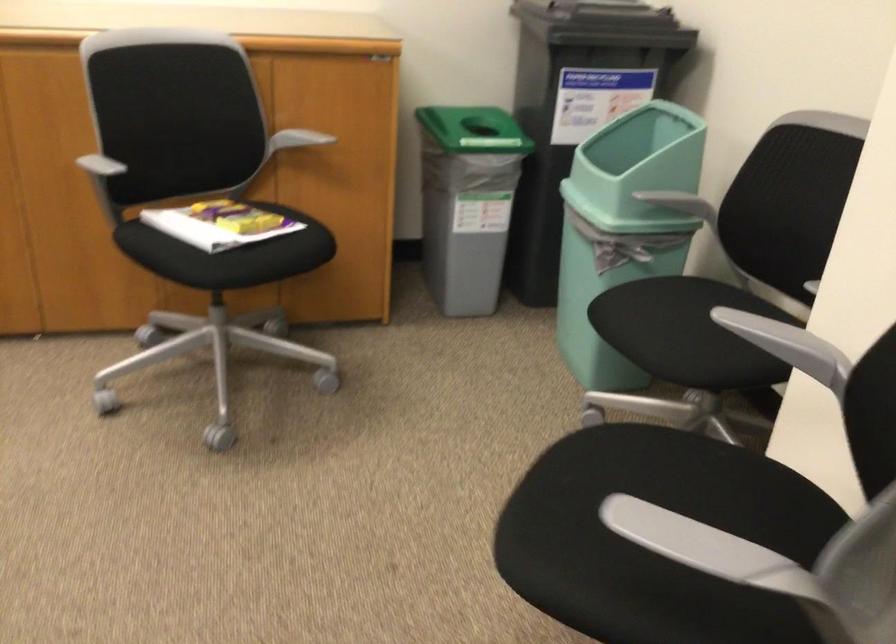
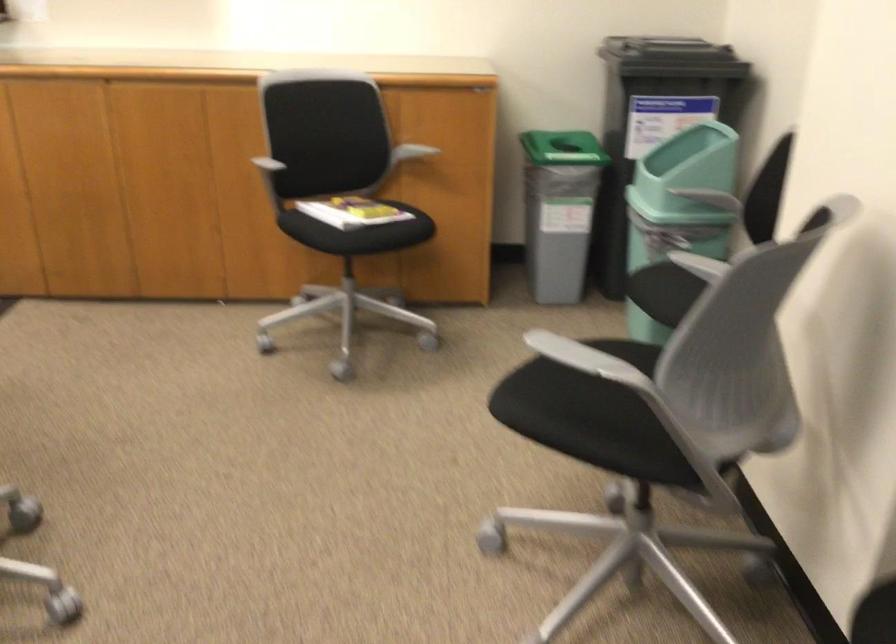
Where in the second image is the point corresponding to (640,214) from the first image?

(678, 207)